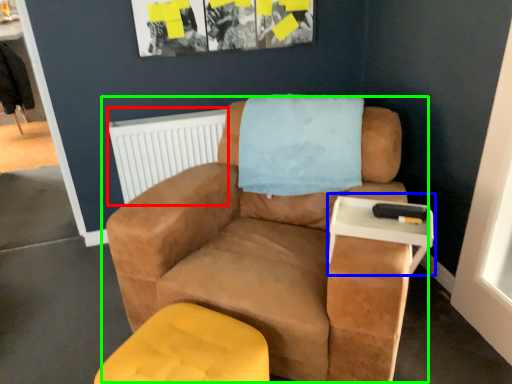
Question: Which object is positioned closest to radiator (highlighted by a red box)? Select from table (highlighted by a blue box) and chair (highlighted by a green box).

Choices:
 (A) table
 (B) chair

Answer: (B)